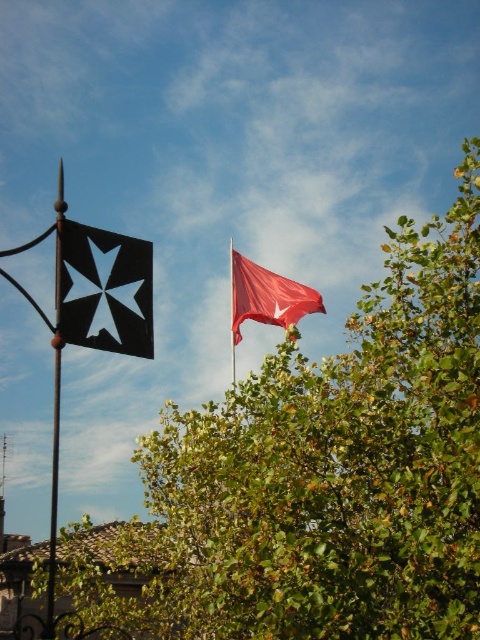
Is matte red flag at center to the left of red fabric flag at upper right from the viewer's perspective?

No, matte red flag at center is not to the left of red fabric flag at upper right.

Does matte red flag at center appear over red fabric flag at upper right?

Indeed, matte red flag at center is positioned over red fabric flag at upper right.

Who is more forward, (245, 291) or (230, 380)?

Point (230, 380) is more forward.

Where is `matte red flag at center`? matte red flag at center is located at coordinates (266, 296).

Measure the distance between green leafy tree at upper center and black matte flag at left.

green leafy tree at upper center is 19.92 meters from black matte flag at left.

Is green leafy tree at upper center thinner than black matte flag at left?

In fact, green leafy tree at upper center might be wider than black matte flag at left.

Which is behind, point (260, 435) or point (121, 333)?

Point (260, 435)

The height and width of the screenshot is (640, 480). Identify the location of green leafy tree at upper center. (324, 474).

Between green leafy tree at upper center and black wrought iron flag pole at left, which one has more height?

green leafy tree at upper center is taller.

This screenshot has height=640, width=480. Find the location of `green leafy tree at upper center`. green leafy tree at upper center is located at coordinates (324, 474).